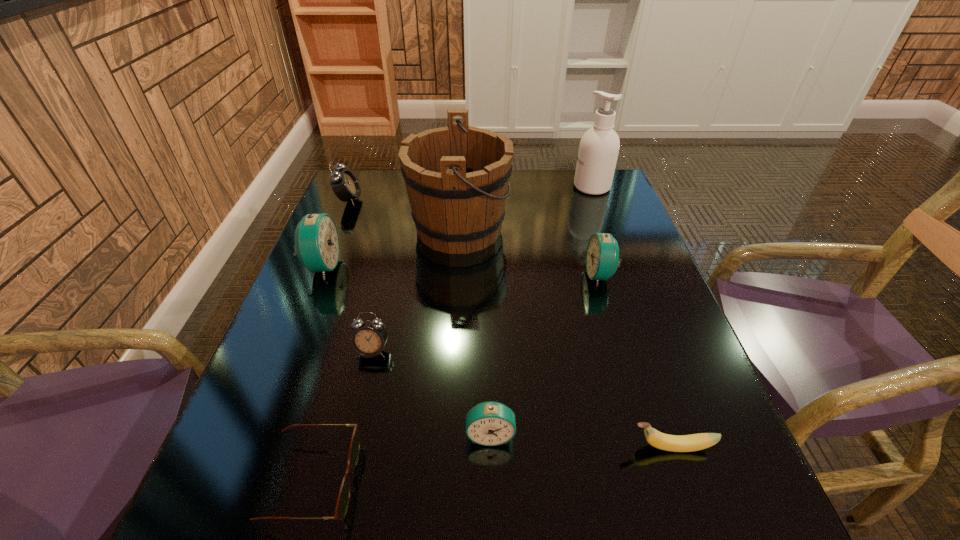
Identify the location of object located at the near left corner. (344, 494).

Where is `object present at the far right corner`? This screenshot has height=540, width=960. object present at the far right corner is located at coordinates (598, 151).

Image resolution: width=960 pixels, height=540 pixels. In the image, there is a desktop. In order to click on free region at the far edge in this screenshot , I will do `click(399, 201)`.

In the image, there is a desktop. Find the location of `free space at the near edge`. free space at the near edge is located at coordinates (432, 526).

At what (x,y) coordinates should I click in order to perform the action: click on vacant space at the left edge. Please return your answer as a coordinate pair (x, y). This screenshot has width=960, height=540. Looking at the image, I should click on (369, 213).

I want to click on free space at the right edge, so click(x=664, y=396).

Identify the location of free location at the near left corner of the desktop. The image size is (960, 540). (268, 526).

Locate an element on the screen. The height and width of the screenshot is (540, 960). vacant region at the far right corner of the desktop is located at coordinates (611, 201).

Find the location of `free space between the nearest blue alarm clock and the shortest object`. free space between the nearest blue alarm clock and the shortest object is located at coordinates (402, 458).

Where is `vacant point located between the farthest alarm clock and the spectacles`? The image size is (960, 540). vacant point located between the farthest alarm clock and the spectacles is located at coordinates (331, 340).